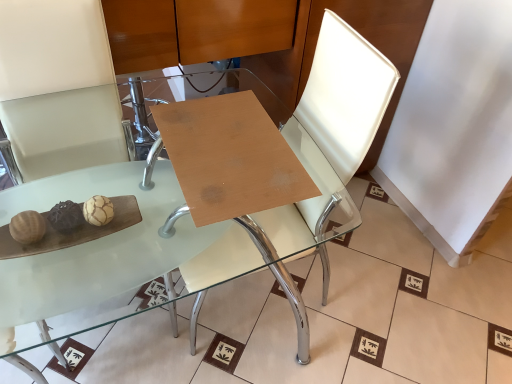
Question: From the image's perspective, is wooden at center, the 1th table in the back-to-front sequence, over white leather swivel chair at center?

Choices:
 (A) no
 (B) yes

Answer: (B)

Question: From a real-world perspective, is wooden at center, acting as the 2th table starting from the front, physically above white leather swivel chair at center?

Choices:
 (A) no
 (B) yes

Answer: (B)

Question: From a real-world perspective, does wooden at center, the 1th table in the back-to-front sequence, sit lower than white leather swivel chair at center?

Choices:
 (A) no
 (B) yes

Answer: (A)

Question: Is wooden at center, acting as the 2th table starting from the front, facing towards white leather swivel chair at center?

Choices:
 (A) yes
 (B) no

Answer: (A)

Question: From the image's perspective, is wooden at center, acting as the 2th table starting from the front, beneath white leather swivel chair at center?

Choices:
 (A) no
 (B) yes

Answer: (A)

Question: From their relative heights in the image, would you say transparent glass table at center, which ranks as the 2th table in back-to-front order, is taller or shorter than wooden at center, acting as the 2th table starting from the front?

Choices:
 (A) tall
 (B) short

Answer: (A)

Question: From a real-world perspective, is transparent glass table at center, marked as the first table in a front-to-back arrangement, positioned above or below wooden at center, acting as the 2th table starting from the front?

Choices:
 (A) below
 (B) above

Answer: (A)

Question: Is transparent glass table at center, marked as the first table in a front-to-back arrangement, wider or thinner than wooden at center, acting as the 2th table starting from the front?

Choices:
 (A) wide
 (B) thin

Answer: (A)

Question: In terms of size, does transparent glass table at center, marked as the first table in a front-to-back arrangement, appear bigger or smaller than wooden at center, acting as the 2th table starting from the front?

Choices:
 (A) big
 (B) small

Answer: (A)

Question: Considering the positions of transparent glass table at center, which ranks as the 2th table in back-to-front order, and white leather swivel chair at center in the image, is transparent glass table at center, which ranks as the 2th table in back-to-front order, taller or shorter than white leather swivel chair at center?

Choices:
 (A) short
 (B) tall

Answer: (A)

Question: In the image, is transparent glass table at center, marked as the first table in a front-to-back arrangement, on the left side or the right side of white leather swivel chair at center?

Choices:
 (A) left
 (B) right

Answer: (A)

Question: Which is correct: transparent glass table at center, marked as the first table in a front-to-back arrangement, is inside white leather swivel chair at center, or outside of it?

Choices:
 (A) outside
 (B) inside

Answer: (A)

Question: Considering their positions, is transparent glass table at center, which ranks as the 2th table in back-to-front order, located in front of or behind white leather swivel chair at center?

Choices:
 (A) behind
 (B) front

Answer: (B)

Question: Is wooden at center, the 1th table in the back-to-front sequence, inside the boundaries of transparent glass table at center, which ranks as the 2th table in back-to-front order, or outside?

Choices:
 (A) inside
 (B) outside

Answer: (A)

Question: Would you say wooden at center, acting as the 2th table starting from the front, is to the left or to the right of transparent glass table at center, which ranks as the 2th table in back-to-front order, in the picture?

Choices:
 (A) left
 (B) right

Answer: (B)